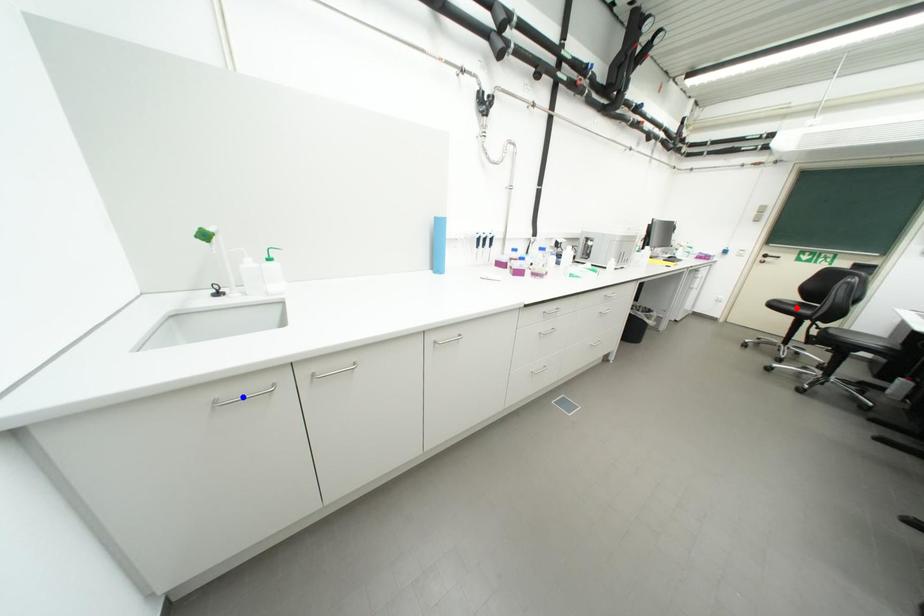
Question: Which of the two points in the image is closer to the camera?

Choices:
 (A) Blue point is closer.
 (B) Red point is closer.

Answer: (A)